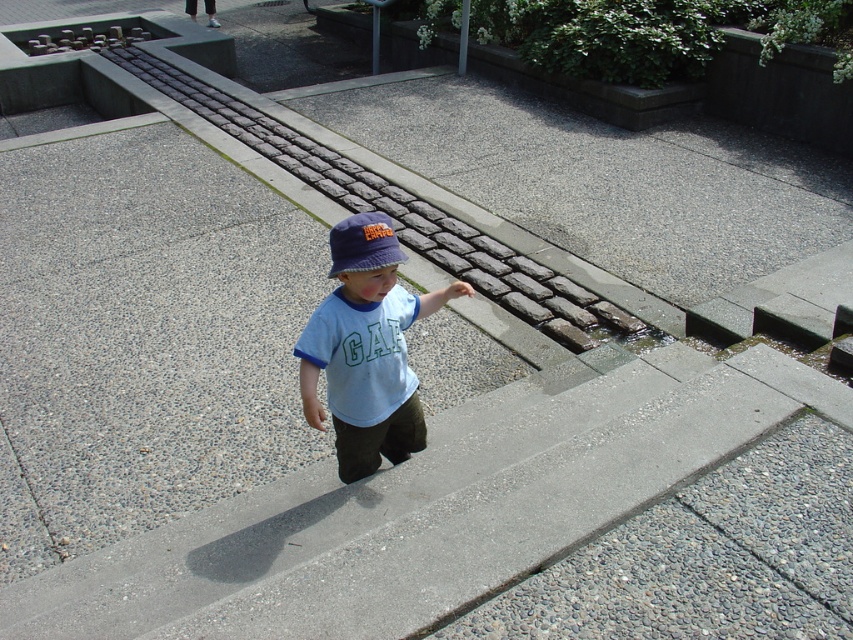
Between light blue cotton shirt at center and blue fabric baseball hat at center, which one is positioned higher?

blue fabric baseball hat at center is above.

Does light blue cotton shirt at center appear under blue fabric baseball hat at center?

Yes.

The image size is (853, 640). What are the coordinates of `light blue cotton shirt at center` in the screenshot? It's located at (366, 348).

Identify the location of light blue cotton shirt at center. The width and height of the screenshot is (853, 640). (366, 348).